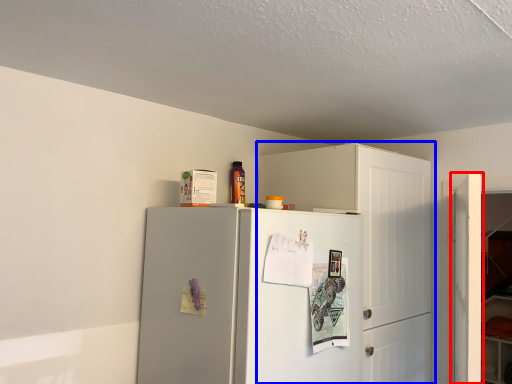
Question: Which point is closer to the camera, door (highlighted by a red box) or cabinetry (highlighted by a blue box)?

Choices:
 (A) door
 (B) cabinetry

Answer: (A)